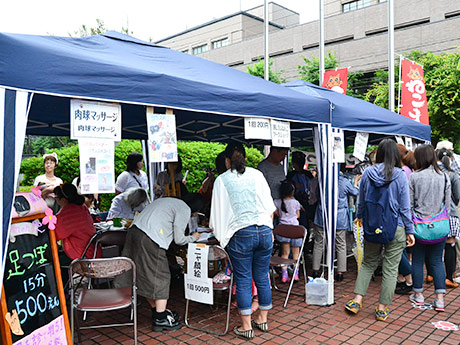
Identify the location of table. (110, 223).